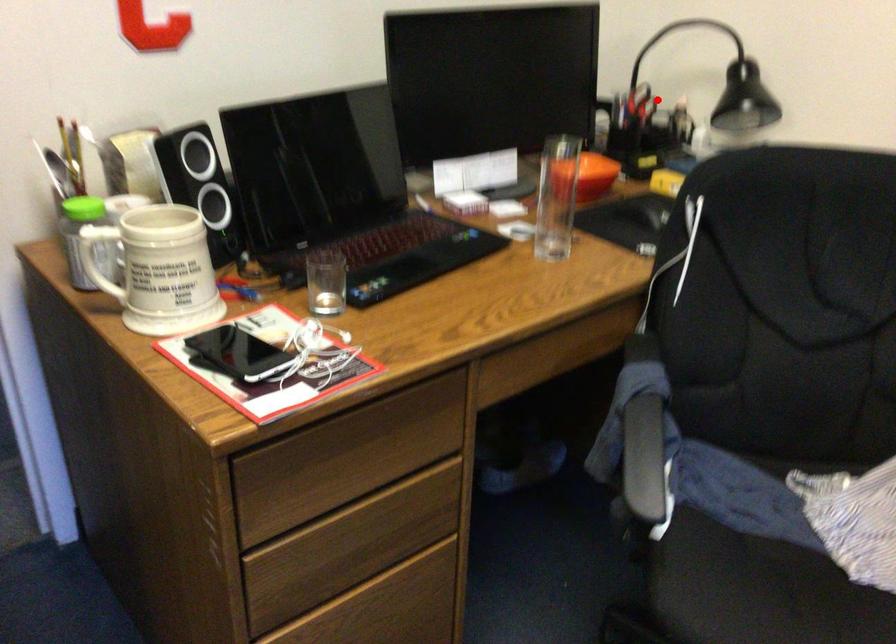
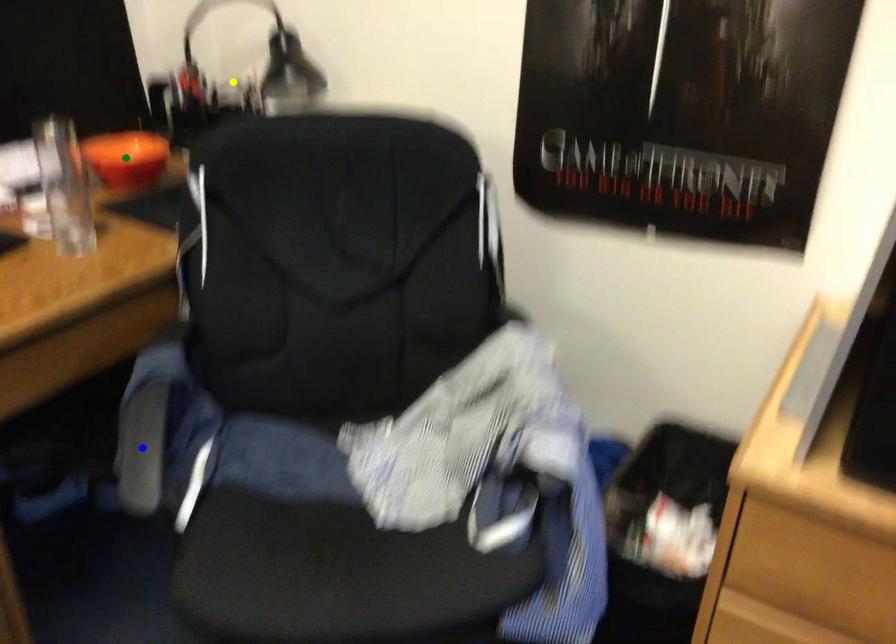
Question: I am providing you with two images of the same scene from different viewpoints. A red point is marked on the first image. You are given multiple points on the second image. Which point in image 2 is actually the same real-world point as the red point in image 1?

Choices:
 (A) yellow point
 (B) green point
 (C) blue point

Answer: (A)